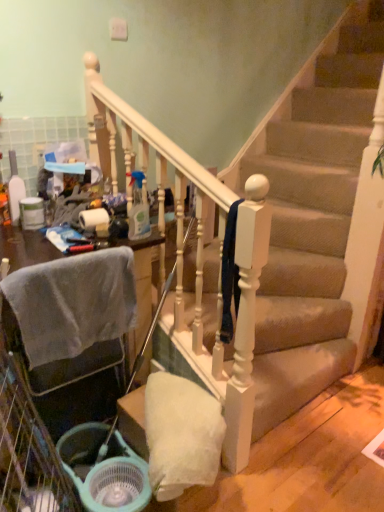
Question: Is white glossy toilet paper at upper left wider or thinner than light blue plastic shopping basket at lower left?

Choices:
 (A) thin
 (B) wide

Answer: (A)

Question: From the image's perspective, is white glossy toilet paper at upper left positioned above or below light blue plastic shopping basket at lower left?

Choices:
 (A) above
 (B) below

Answer: (A)

Question: Which is nearer to the carpeted stairs at center?

Choices:
 (A) light blue plastic shopping basket at lower left
 (B) gray fabric chair at left
 (C) clear plastic spray bottle at center, the 1th bottle in the right-to-left sequence
 (D) white glossy toilet paper at upper left
 (E) translucent plastic spray bottle at left, which is counted as the 2th bottle, starting from the right

Answer: (B)

Question: Estimate the real-world distances between objects in this image. Which object is farther from the gray fabric chair at left?

Choices:
 (A) carpeted stairs at center
 (B) translucent plastic spray bottle at left, which is counted as the 2th bottle, starting from the right
 (C) white glossy toilet paper at upper left
 (D) light blue plastic shopping basket at lower left
 (E) clear plastic spray bottle at center, which ranks as the second bottle in left-to-right order

Answer: (A)